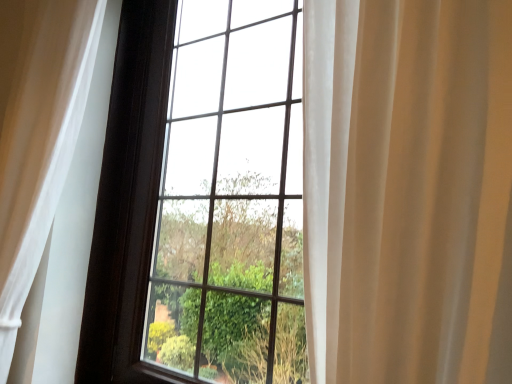
Question: Is white sheer curtain at left positioned beyond the bounds of transparent glass window at center?

Choices:
 (A) yes
 (B) no

Answer: (A)

Question: Does white sheer curtain at left have a lesser height compared to transparent glass window at center?

Choices:
 (A) no
 (B) yes

Answer: (B)

Question: From the image's perspective, is white sheer curtain at left under transparent glass window at center?

Choices:
 (A) no
 (B) yes

Answer: (A)

Question: Does white sheer curtain at left appear on the right side of transparent glass window at center?

Choices:
 (A) yes
 (B) no

Answer: (B)

Question: Considering the relative positions of white sheer curtain at left and transparent glass window at center in the image provided, is white sheer curtain at left to the left of transparent glass window at center from the viewer's perspective?

Choices:
 (A) no
 (B) yes

Answer: (B)

Question: Is white sheer curtain at left wider than transparent glass window at center?

Choices:
 (A) yes
 (B) no

Answer: (A)

Question: Considering the relative positions of transparent glass window at center and white sheer curtain at left in the image provided, is transparent glass window at center in front of white sheer curtain at left?

Choices:
 (A) yes
 (B) no

Answer: (A)

Question: From the image's perspective, does transparent glass window at center appear higher than white sheer curtain at left?

Choices:
 (A) yes
 (B) no

Answer: (B)

Question: Is transparent glass window at center next to white sheer curtain at left?

Choices:
 (A) yes
 (B) no

Answer: (B)

Question: Can you confirm if transparent glass window at center is bigger than white sheer curtain at left?

Choices:
 (A) no
 (B) yes

Answer: (B)

Question: Is white sheer curtain at left a part of transparent glass window at center?

Choices:
 (A) no
 (B) yes

Answer: (A)

Question: Considering the relative sizes of transparent glass window at center and white sheer curtain at left in the image provided, is transparent glass window at center thinner than white sheer curtain at left?

Choices:
 (A) no
 (B) yes

Answer: (B)

Question: Is white sheer curtain at left taller or shorter than transparent glass window at center?

Choices:
 (A) tall
 (B) short

Answer: (B)